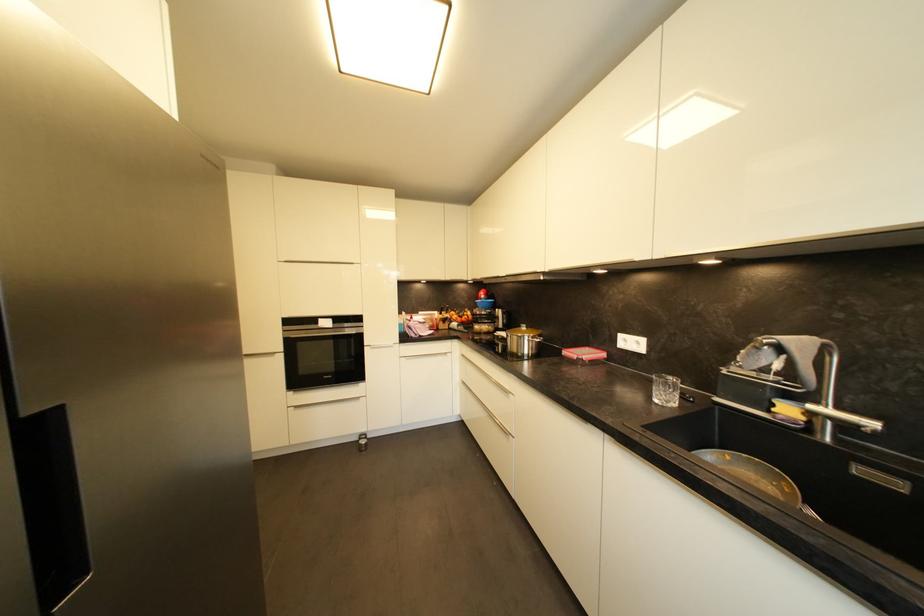
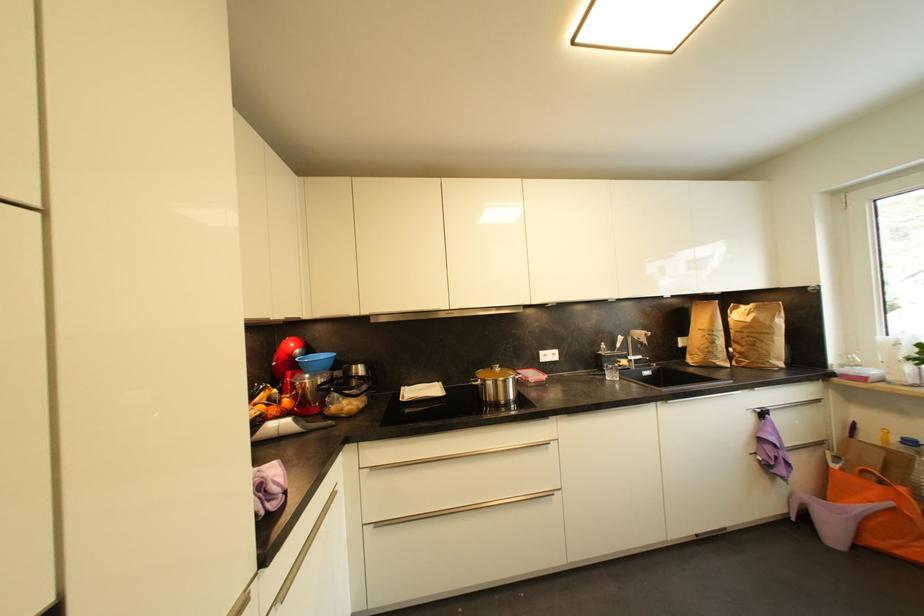
In the second image, find the point that corresponds to the point at 468,384 in the first image.

(382, 527)